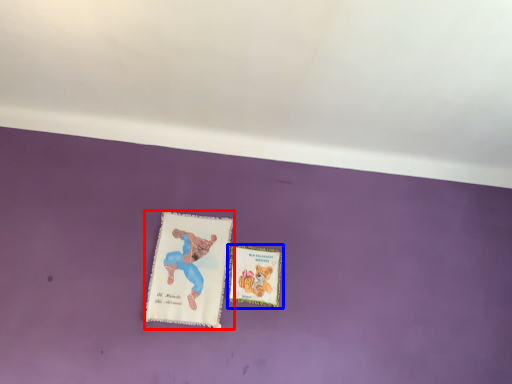
Question: Which object is further to the camera taking this photo, paperback book (highlighted by a red box) or paperback book (highlighted by a blue box)?

Choices:
 (A) paperback book
 (B) paperback book

Answer: (B)